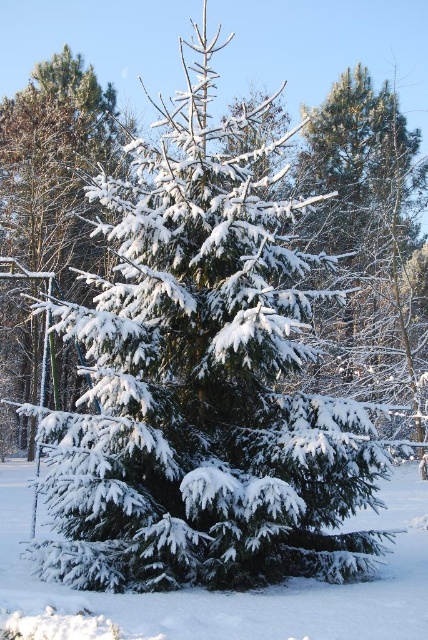
Measure the distance between point (x=312, y=138) and camera.

The distance of point (x=312, y=138) from camera is 33.87 meters.

Who is lower down, green matte evergreen tree at upper right or white fluffy snow at center?

Positioned lower is white fluffy snow at center.

Is point (356, 224) closer to camera compared to point (270, 636)?

No.

Locate an element on the screen. The image size is (428, 640). green matte evergreen tree at upper right is located at coordinates (369, 241).

Does white fluffy snow at center have a lesser width compared to white frosty pine at left?

No.

Does point (5, 483) lie in front of point (20, 170)?

Yes.

You are a GUI agent. You are given a task and a screenshot of the screen. Output one action in this format:
    pyautogui.click(x=<x>, y=<y>)
    Task: Click on the white fluffy snow at center
    The width and height of the screenshot is (428, 640).
    Given the screenshot: What is the action you would take?
    pyautogui.click(x=246, y=592)

Who is more distant from viewer, (348,340) or (59,259)?

Positioned behind is point (59,259).

In order to click on green matte evergreen tree at upper right in this screenshot , I will do `click(369, 241)`.